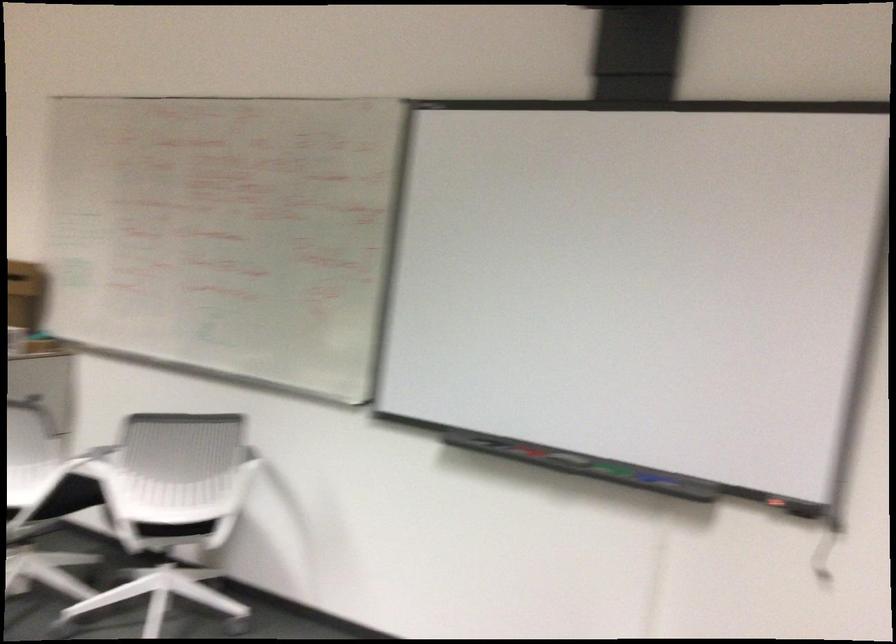
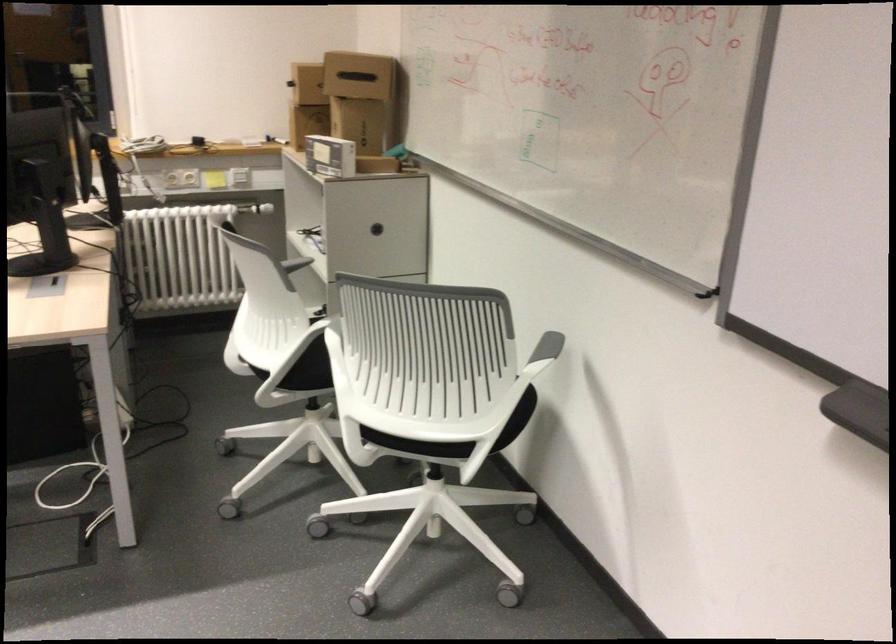
The point at (168, 534) is marked in the first image. Where is the corresponding point in the second image?

(418, 444)